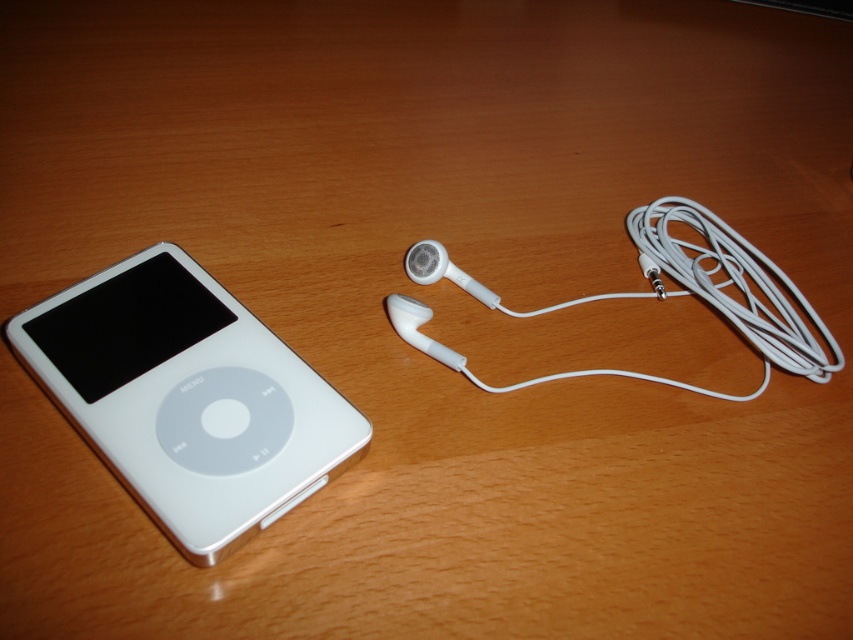
Is white plastic ipod at left bigger than white matte earphone at center right?

No, white plastic ipod at left is not bigger than white matte earphone at center right.

Is white plastic ipod at left to the right of white matte earphone at center right from the viewer's perspective?

No, white plastic ipod at left is not to the right of white matte earphone at center right.

Is point (149, 282) more distant than point (757, 298)?

No, it is in front of (757, 298).

At what (x,y) coordinates should I click in order to perform the action: click on white plastic ipod at left. Please return your answer as a coordinate pair (x, y). Looking at the image, I should click on click(x=187, y=397).